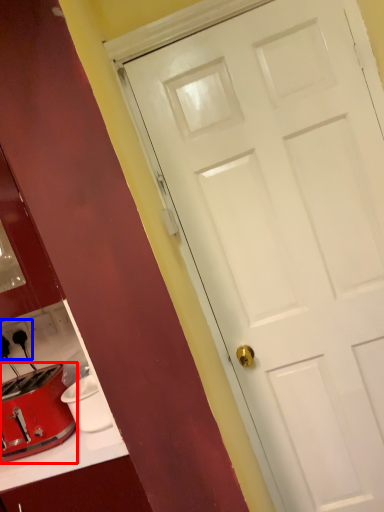
Question: Which object is further to the camera taking this photo, toaster (highlighted by a red box) or electric outlet (highlighted by a blue box)?

Choices:
 (A) toaster
 (B) electric outlet

Answer: (B)